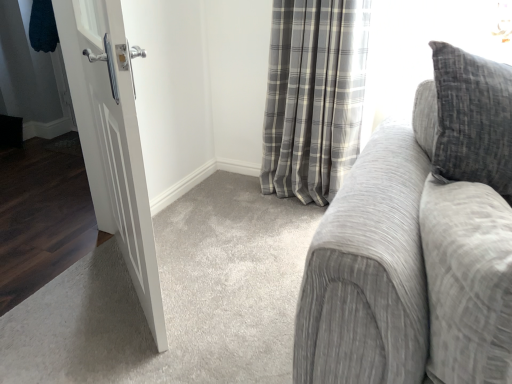
Question: Is white matte door at left wider than textured gray couch at right?

Choices:
 (A) yes
 (B) no

Answer: (B)

Question: Is white matte door at left to the left of textured gray couch at right from the viewer's perspective?

Choices:
 (A) yes
 (B) no

Answer: (A)

Question: Is white matte door at left thinner than textured gray couch at right?

Choices:
 (A) no
 (B) yes

Answer: (B)

Question: From the image's perspective, is white matte door at left above textured gray couch at right?

Choices:
 (A) no
 (B) yes

Answer: (A)

Question: From the image's perspective, is white matte door at left beneath textured gray couch at right?

Choices:
 (A) no
 (B) yes

Answer: (B)

Question: Does white matte door at left appear on the right side of textured gray couch at right?

Choices:
 (A) no
 (B) yes

Answer: (A)

Question: Are white matte door at left and gray plaid curtain at center making contact?

Choices:
 (A) no
 (B) yes

Answer: (A)

Question: Is gray plaid curtain at center at the back of white matte door at left?

Choices:
 (A) no
 (B) yes

Answer: (B)

Question: Is white matte door at left taller than gray plaid curtain at center?

Choices:
 (A) yes
 (B) no

Answer: (A)

Question: Does white matte door at left have a smaller size compared to gray plaid curtain at center?

Choices:
 (A) yes
 (B) no

Answer: (A)

Question: Can you confirm if white matte door at left is thinner than gray plaid curtain at center?

Choices:
 (A) yes
 (B) no

Answer: (A)

Question: Is white matte door at left to the right of gray plaid curtain at center from the viewer's perspective?

Choices:
 (A) no
 (B) yes

Answer: (A)

Question: Is gray plaid curtain at center to the right of textured gray couch at right from the viewer's perspective?

Choices:
 (A) no
 (B) yes

Answer: (A)